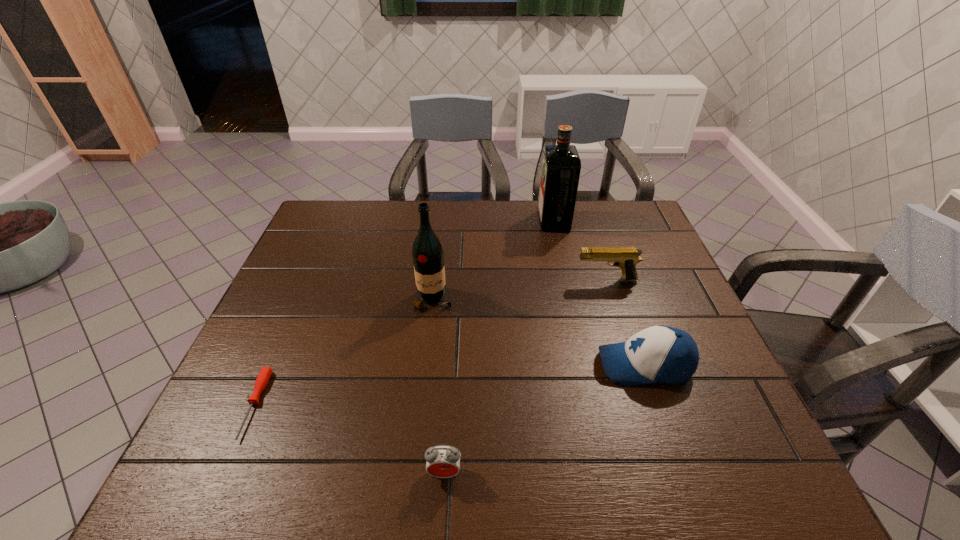
Identify the location of vacant region located 0.200m on the surface of the wine bottle. (424, 377).

The image size is (960, 540). Identify the location of free spot located 0.120m on the front-facing side of the baseball cap. [547, 365].

Image resolution: width=960 pixels, height=540 pixels. Identify the location of vacant region located on the front-facing side of the baseball cap. (474, 365).

This screenshot has height=540, width=960. I want to click on vacant space located 0.400m on the front-facing side of the baseball cap, so click(x=428, y=365).

This screenshot has width=960, height=540. I want to click on free space located 0.380m at the barrel of the pistol, so click(443, 280).

Locate an element on the screen. The image size is (960, 540). vacant space situated 0.310m at the barrel of the pistol is located at coordinates pyautogui.click(x=467, y=280).

I want to click on vacant space situated 0.130m at the barrel of the pistol, so click(x=530, y=280).

At what (x,y) coordinates should I click in order to perform the action: click on object positioned at the far edge. Please return your answer as a coordinate pair (x, y). Image resolution: width=960 pixels, height=540 pixels. Looking at the image, I should click on (561, 165).

This screenshot has width=960, height=540. Identify the location of object at the near edge. (443, 461).

Where is `object that is at the left edge`? object that is at the left edge is located at coordinates (262, 380).